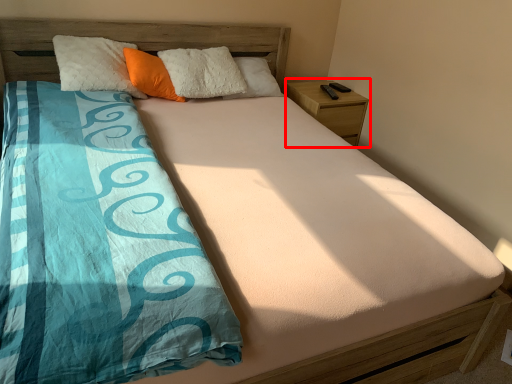
Question: In this image, where is nightstand (annotated by the red box) located relative to pillow?

Choices:
 (A) left
 (B) right

Answer: (B)